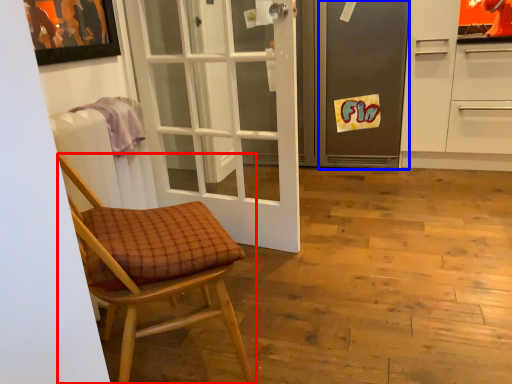
Question: Which point is closer to the camera, chair (highlighted by a red box) or screen door (highlighted by a blue box)?

Choices:
 (A) chair
 (B) screen door

Answer: (A)